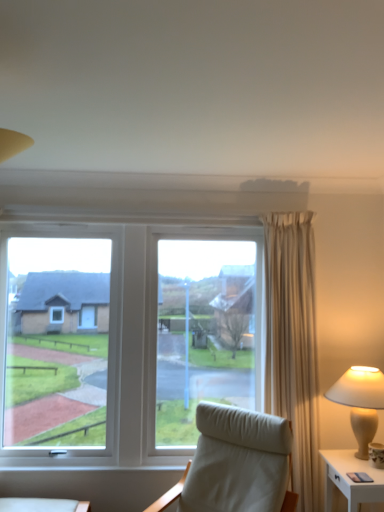
Where is `white glossy nightstand at lower right`? white glossy nightstand at lower right is located at coordinates (350, 479).

Where is `white ceramic lamp at right`? white ceramic lamp at right is located at coordinates (360, 402).

Considering the sizes of objects white glossy nightstand at lower right and white ceramic lamp at right in the image provided, who is thinner, white glossy nightstand at lower right or white ceramic lamp at right?

white glossy nightstand at lower right is thinner.

From a real-world perspective, which object rests below the other?

From a 3D spatial view, white glossy nightstand at lower right is below.

In the scene shown: Which of these two, white glossy nightstand at lower right or white ceramic lamp at right, is bigger?

white ceramic lamp at right.

Which of these two, white glossy nightstand at lower right or white ceramic lamp at right, stands shorter?

white glossy nightstand at lower right is shorter.

Considering the sizes of objects white ceramic lamp at right and white glossy nightstand at lower right in the image provided, who is shorter, white ceramic lamp at right or white glossy nightstand at lower right?

white glossy nightstand at lower right.

From a real-world perspective, between white ceramic lamp at right and white glossy nightstand at lower right, who is vertically higher?

From a 3D spatial view, white ceramic lamp at right is above.

Looking at their sizes, would you say white ceramic lamp at right is wider or thinner than white glossy nightstand at lower right?

Clearly, white ceramic lamp at right has more width compared to white glossy nightstand at lower right.

From the image's perspective, is white glossy nightstand at lower right located above or below white fabric chair at center?

white glossy nightstand at lower right is below white fabric chair at center.

How different are the orientations of white glossy nightstand at lower right and white fabric chair at center in degrees?

The angular difference between white glossy nightstand at lower right and white fabric chair at center is 47.5 degrees.

Considering the relative positions of white glossy nightstand at lower right and white fabric chair at center in the image provided, is white glossy nightstand at lower right to the left or to the right of white fabric chair at center?

Based on their positions, white glossy nightstand at lower right is located to the right of white fabric chair at center.

Considering the sizes of white glossy nightstand at lower right and white fabric chair at center in the image, is white glossy nightstand at lower right wider or thinner than white fabric chair at center?

In the image, white glossy nightstand at lower right appears to be more narrow than white fabric chair at center.

Is white fabric chair at center with white glossy nightstand at lower right?

No, white fabric chair at center is not making contact with white glossy nightstand at lower right.

Considering their positions, is white fabric chair at center located in front of or behind white glossy nightstand at lower right?

white fabric chair at center is positioned closer to the viewer than white glossy nightstand at lower right.

From the image's perspective, is white fabric chair at center under white glossy nightstand at lower right?

No.

From a real-world perspective, which object rests below the other?

white glossy nightstand at lower right is physically lower.

Looking at this image, from the image's perspective, is white ceramic lamp at right below white fabric chair at center?

Actually, white ceramic lamp at right appears above white fabric chair at center in the image.

Consider the image. Is white ceramic lamp at right aimed at white fabric chair at center?

Yes, white ceramic lamp at right is turned towards white fabric chair at center.

Where is `chair in front of the white ceramic lamp at right`? This screenshot has height=512, width=384. chair in front of the white ceramic lamp at right is located at coordinates (236, 463).

Which is behind, white ceramic lamp at right or white fabric chair at center?

white ceramic lamp at right is behind.

Find the location of a particular element. The image size is (384, 512). lamp above the white fabric chair at center (from a real-world perspective) is located at coordinates (360, 402).

Is point (227, 483) closer or farther from the camera than point (325, 395)?

Point (227, 483) appears to be closer to the viewer than point (325, 395).

Consider the image. Considering the relative sizes of white fabric chair at center and white ceramic lamp at right in the image provided, is white fabric chair at center wider than white ceramic lamp at right?

Indeed, white fabric chair at center has a greater width compared to white ceramic lamp at right.

The width and height of the screenshot is (384, 512). What are the coordinates of `lamp above the white glossy nightstand at lower right (from the image's perspective)` in the screenshot? It's located at (360, 402).

At what (x,y) coordinates should I click in order to perform the action: click on lamp above the white glossy nightstand at lower right (from a real-world perspective). Please return your answer as a coordinate pair (x, y). Looking at the image, I should click on (360, 402).

Considering their positions, is white glossy nightstand at lower right positioned further to white ceramic lamp at right than white fabric chair at center?

Based on the image, white fabric chair at center appears to be further to white ceramic lamp at right.

Estimate the real-world distances between objects in this image. Which object is further from white glossy nightstand at lower right, white fabric chair at center or white ceramic lamp at right?

white fabric chair at center.

Which object lies further to the anchor point white glossy nightstand at lower right, white ceramic lamp at right or white fabric chair at center?

Among the two, white fabric chair at center is located further to white glossy nightstand at lower right.

When comparing their distances from white fabric chair at center, does white glossy nightstand at lower right or white ceramic lamp at right seem further?

white ceramic lamp at right lies further to white fabric chair at center than the other object.

Estimate the real-world distances between objects in this image. Which object is further from white ceramic lamp at right, white fabric chair at center or white glossy nightstand at lower right?

Based on the image, white fabric chair at center appears to be further to white ceramic lamp at right.

Based on their spatial positions, is white ceramic lamp at right or white glossy nightstand at lower right further from white fabric chair at center?

Based on the image, white ceramic lamp at right appears to be further to white fabric chair at center.

You are a GUI agent. You are given a task and a screenshot of the screen. Output one action in this format:
    pyautogui.click(x=<x>, y=<y>)
    Task: Click on the nightstand located between white fabric chair at center and white ceramic lamp at right in the left-right direction
    
    Given the screenshot: What is the action you would take?
    pyautogui.click(x=350, y=479)